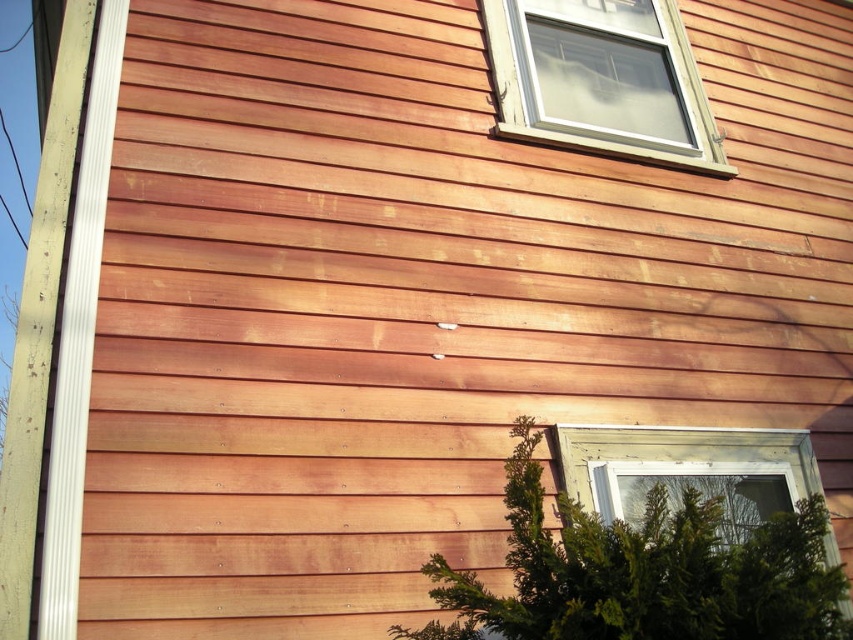
You are standing in front of the house and want to locate the white plastic window at upper right. Based on the coordinates provided, where should you look relative to the center of the image?

The white plastic window at upper right is located at coordinates point (601, 80), which is to the left and above the center of the image.

You are a window installer assessing the house exterior. You need to determine which object takes up more area on the wall between the clear glass window at lower right and the white painted wood trim at left. Which one is larger in size?

The white painted wood trim at left occupies more space than the clear glass window at lower right according to the description, so the white painted wood trim at left is larger in size.